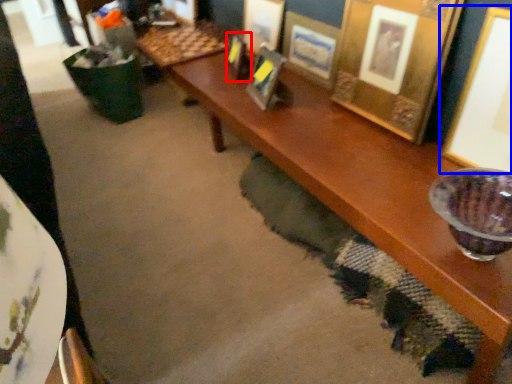
Question: Which object is closer to the camera taking this photo, picture frame (highlighted by a red box) or picture frame (highlighted by a blue box)?

Choices:
 (A) picture frame
 (B) picture frame

Answer: (B)